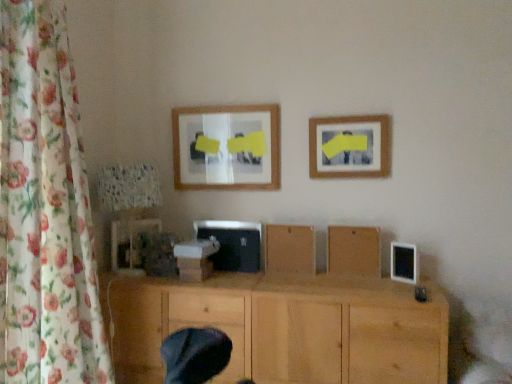
Question: Is matte wooden picture frame at upper center, the second picture frame in the left-to-right sequence, further to the viewer compared to matte plastic picture frame at lower left, which is counted as the third picture frame, starting from the top?

Choices:
 (A) yes
 (B) no

Answer: (B)

Question: From a real-world perspective, is matte wooden picture frame at upper center, the third picture frame in the bottom-to-top sequence, over matte plastic picture frame at lower left, which is the 3th picture frame in right-to-left order?

Choices:
 (A) yes
 (B) no

Answer: (A)

Question: Can you confirm if matte wooden picture frame at upper center, the third picture frame in the bottom-to-top sequence, is wider than matte plastic picture frame at lower left, the first picture frame in the bottom-to-top sequence?

Choices:
 (A) no
 (B) yes

Answer: (A)

Question: From a real-world perspective, is matte wooden picture frame at upper center, the second picture frame in the left-to-right sequence, physically below matte plastic picture frame at lower left, which is counted as the third picture frame, starting from the top?

Choices:
 (A) no
 (B) yes

Answer: (A)

Question: Is matte wooden picture frame at upper center, arranged as the 1th picture frame when viewed from the top, bigger than matte plastic picture frame at lower left, the first picture frame in the bottom-to-top sequence?

Choices:
 (A) yes
 (B) no

Answer: (A)

Question: From a real-world perspective, is wooden board at center, marked as the 2th wood in a bottom-to-top arrangement, physically located above or below floral fabric curtain at left?

Choices:
 (A) above
 (B) below

Answer: (B)

Question: Looking at the image, does wooden board at center, marked as the 2th wood in a bottom-to-top arrangement, seem bigger or smaller compared to floral fabric curtain at left?

Choices:
 (A) small
 (B) big

Answer: (A)

Question: From their relative heights in the image, would you say wooden board at center, the 2th wood in the top-to-bottom sequence, is taller or shorter than floral fabric curtain at left?

Choices:
 (A) short
 (B) tall

Answer: (A)

Question: Considering the relative positions of wooden board at center, marked as the 2th wood in a bottom-to-top arrangement, and floral fabric curtain at left in the image provided, is wooden board at center, marked as the 2th wood in a bottom-to-top arrangement, to the left or to the right of floral fabric curtain at left?

Choices:
 (A) right
 (B) left

Answer: (A)

Question: Considering the positions of point (145, 288) and point (377, 236), is point (145, 288) closer or farther from the camera than point (377, 236)?

Choices:
 (A) closer
 (B) farther

Answer: (A)

Question: Is natural wood cabinet at center, the 1th wood in the bottom-to-top sequence, to the left or to the right of wooden board at center, marked as the 2th wood in a bottom-to-top arrangement, in the image?

Choices:
 (A) left
 (B) right

Answer: (A)

Question: Based on their sizes in the image, would you say natural wood cabinet at center, the 1th wood in the bottom-to-top sequence, is bigger or smaller than wooden board at center, marked as the 2th wood in a bottom-to-top arrangement?

Choices:
 (A) small
 (B) big

Answer: (B)

Question: In the image, is natural wood cabinet at center, the 1th wood in the bottom-to-top sequence, positioned in front of or behind wooden board at center, marked as the 2th wood in a bottom-to-top arrangement?

Choices:
 (A) front
 (B) behind

Answer: (A)

Question: From their relative heights in the image, would you say matte plastic picture frame at lower left, which is the 3th picture frame in right-to-left order, is taller or shorter than brown matte wood at center, acting as the third wood starting from the bottom?

Choices:
 (A) tall
 (B) short

Answer: (B)

Question: From a real-world perspective, is matte plastic picture frame at lower left, which is the 3th picture frame in right-to-left order, above or below brown matte wood at center, the first wood viewed from the top?

Choices:
 (A) below
 (B) above

Answer: (B)